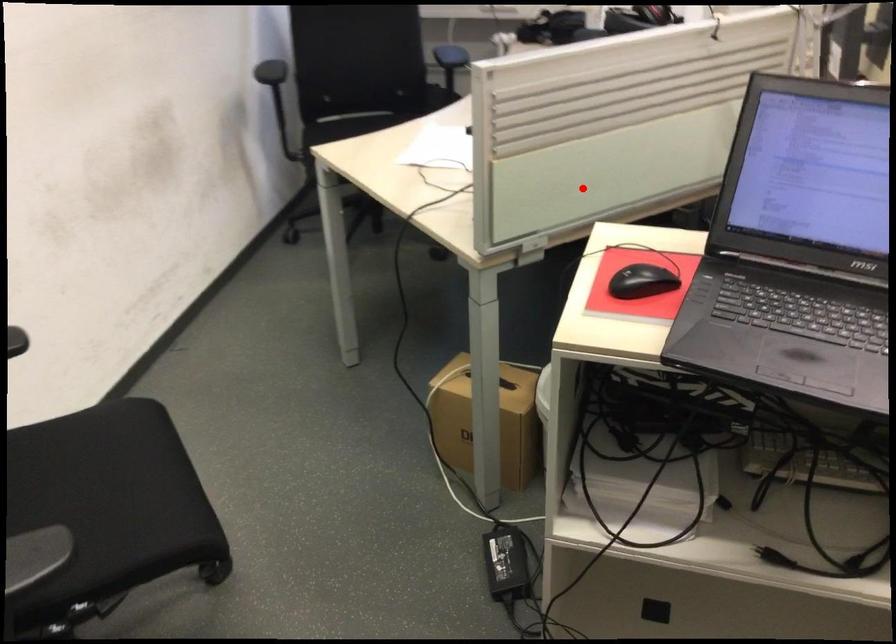
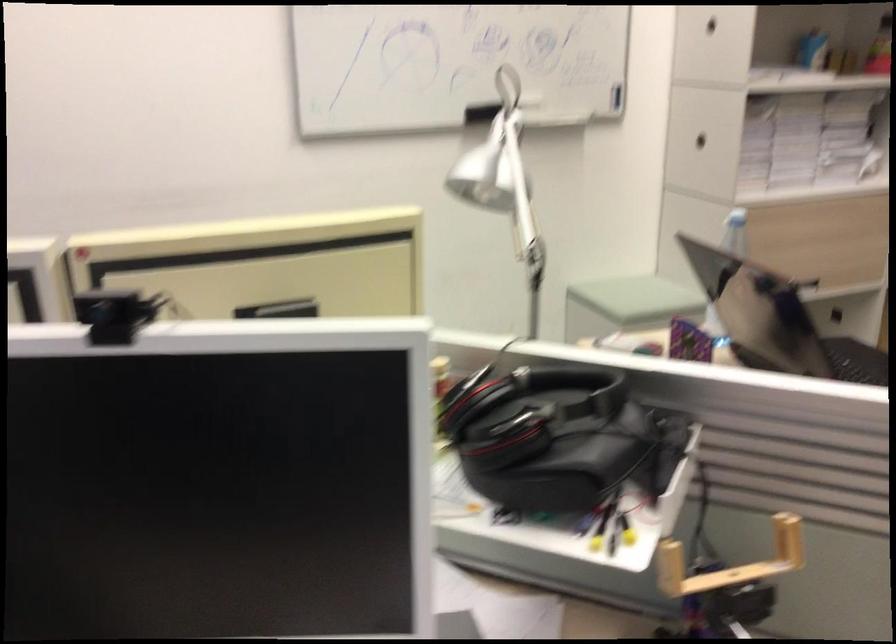
Question: I am providing you with two images of the same scene from different viewpoints. A red point is shown in image1. For the corresponding object point in image2, is it positioned nearer or farther from the camera?

Choices:
 (A) Nearer
 (B) Farther

Answer: (A)